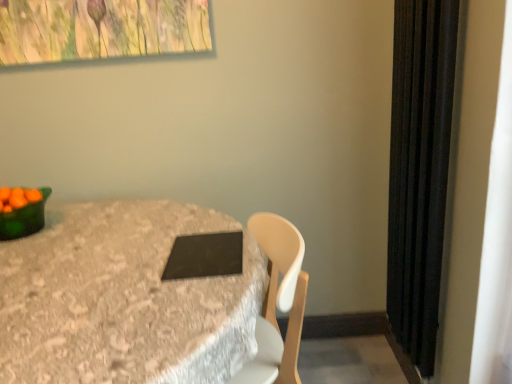
Identify the location of free spot in front of black matte pad at center. (189, 289).